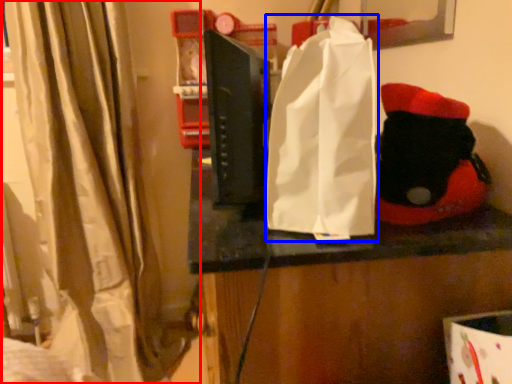
Question: Among these objects, which one is farthest to the camera, curtain (highlighted by a red box) or grocery bag (highlighted by a blue box)?

Choices:
 (A) curtain
 (B) grocery bag

Answer: (A)